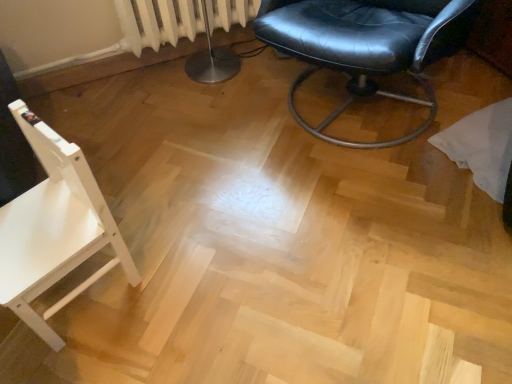
I want to click on free point behind white wood chair at left, the first chair in the left-to-right sequence, so click(137, 206).